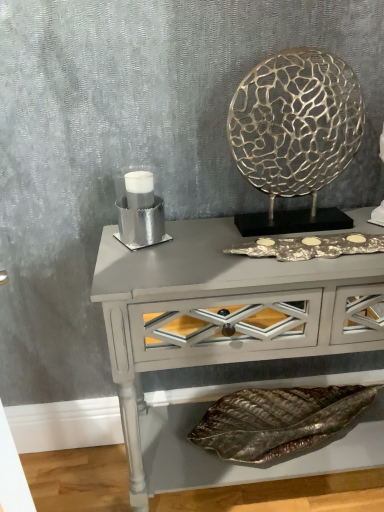
Question: From the image's perspective, relative to metallic leaf at lower center, is silver metallic candle holder at left above or below?

Choices:
 (A) above
 (B) below

Answer: (A)

Question: Which is correct: silver metallic candle holder at left is inside metallic leaf at lower center, or outside of it?

Choices:
 (A) inside
 (B) outside

Answer: (B)

Question: Which object is the closest to the matte gray console table at center?

Choices:
 (A) gold textured metal at upper right
 (B) silver metallic candle holder at left
 (C) metallic leaf at lower center

Answer: (B)

Question: Considering the real-world distances, which object is farthest from the matte gray console table at center?

Choices:
 (A) metallic leaf at lower center
 (B) gold textured metal at upper right
 (C) silver metallic candle holder at left

Answer: (A)